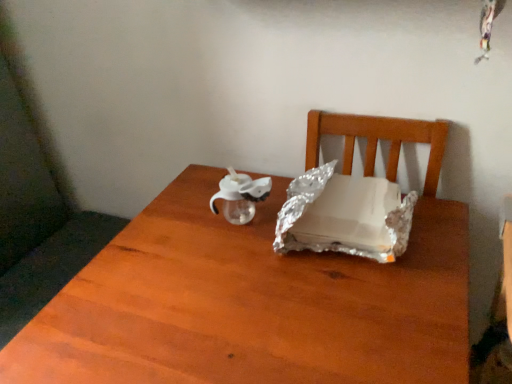
Locate an element on the screen. blank space above wooden table at center (from a real-world perspective) is located at coordinates (243, 279).